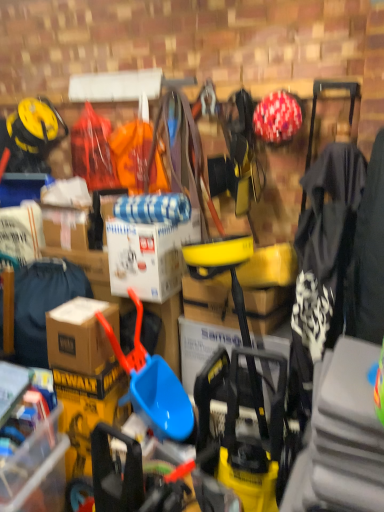
What is the approximate width of brown cardboard box at lower left?

brown cardboard box at lower left is 52.06 centimeters wide.

This screenshot has height=512, width=384. Identify the location of blue plastic shovel at center. (152, 385).

This screenshot has height=512, width=384. What do you see at coordinates (368, 256) in the screenshot?
I see `black fabric jacket at right, which ranks as the 1th clothing in front-to-back order` at bounding box center [368, 256].

Describe the element at coordinates (42, 304) in the screenshot. The height and width of the screenshot is (512, 384). I see `brown cardboard box at left, which is the first clothing from back to front` at that location.

The width and height of the screenshot is (384, 512). Find the location of `brown cardboard box at lower left`. brown cardboard box at lower left is located at coordinates (36, 470).

Considering the relative sizes of blue plastic shovel at center and white matte cardboard box at center in the image provided, is blue plastic shovel at center smaller than white matte cardboard box at center?

Incorrect, blue plastic shovel at center is not smaller in size than white matte cardboard box at center.

Could you tell me if blue plastic shovel at center is turned towards white matte cardboard box at center?

No, blue plastic shovel at center does not turn towards white matte cardboard box at center.

From the image's perspective, is blue plastic shovel at center over white matte cardboard box at center?

Incorrect, from the image's perspective, blue plastic shovel at center is lower than white matte cardboard box at center.

From a real-world perspective, who is located lower, blue plastic shovel at center or white matte cardboard box at center?

From a 3D spatial view, blue plastic shovel at center is below.

Which is less distant, (139, 369) or (88, 359)?

The point (88, 359) is closer to the camera.

Considering the sizes of objects blue plastic shovel at center and brown cardboard box at lower left in the image provided, who is wider, blue plastic shovel at center or brown cardboard box at lower left?

With larger width is brown cardboard box at lower left.

Which object is positioned more to the right, blue plastic shovel at center or brown cardboard box at lower left?

Positioned to the right is blue plastic shovel at center.

Does blue plastic shovel at center come behind brown cardboard box at lower left?

No, blue plastic shovel at center is closer to the viewer.

Is brown cardboard box at left, the 1th clothing from the left, to the right of black fabric jacket at right, the first clothing from the right, from the viewer's perspective?

In fact, brown cardboard box at left, the 1th clothing from the left, is to the left of black fabric jacket at right, the first clothing from the right.

Can you confirm if brown cardboard box at left, the 1th clothing from the left, is shorter than black fabric jacket at right, marked as the second clothing in a back-to-front arrangement?

Yes.

From a real-world perspective, which object rests below the other?

brown cardboard box at left, which is the first clothing from back to front.

Does point (64, 263) come closer to viewer compared to point (354, 254)?

No, (64, 263) is behind (354, 254).

Identify the location of storage box located on the left of black fabric jacket at right, placed as the second clothing when sorted from left to right. The height and width of the screenshot is (512, 384). (36, 470).

Can you tell me how much brown cardboard box at lower left and black fabric jacket at right, which ranks as the 1th clothing in front-to-back order, differ in facing direction?

7.02 degrees separate the facing orientations of brown cardboard box at lower left and black fabric jacket at right, which ranks as the 1th clothing in front-to-back order.

Does brown cardboard box at lower left contain black fabric jacket at right, placed as the second clothing when sorted from left to right?

No, black fabric jacket at right, placed as the second clothing when sorted from left to right, is not surrounded by brown cardboard box at lower left.

Relative to black fabric jacket at right, placed as the second clothing when sorted from left to right, is brown cardboard box at lower left in front or behind?

brown cardboard box at lower left is behind black fabric jacket at right, placed as the second clothing when sorted from left to right.

Is the depth of white matte cardboard box at center less than that of brown cardboard box at lower left?

No, white matte cardboard box at center is further to the viewer.

Is white matte cardboard box at center outside of brown cardboard box at lower left?

Indeed, white matte cardboard box at center is completely outside brown cardboard box at lower left.

How much distance is there between white matte cardboard box at center and brown cardboard box at lower left?

A distance of 29.22 inches exists between white matte cardboard box at center and brown cardboard box at lower left.

Considering the relative positions of white matte cardboard box at center and brown cardboard box at lower left in the image provided, is white matte cardboard box at center to the right of brown cardboard box at lower left from the viewer's perspective?

Correct, you'll find white matte cardboard box at center to the right of brown cardboard box at lower left.

Is white matte cardboard box at center positioned in front of brown cardboard box at lower left?

No, the depth of white matte cardboard box at center is greater than that of brown cardboard box at lower left.

Does white matte cardboard box at center have a smaller size compared to brown cardboard box at lower left?

Actually, white matte cardboard box at center might be larger than brown cardboard box at lower left.

From a real-world perspective, between white matte cardboard box at center and brown cardboard box at lower left, who is vertically higher?

white matte cardboard box at center is physically above.

Consider the image. Is brown cardboard box at lower left far away from brown cardboard box at lower left?

No, there isn't a large distance between brown cardboard box at lower left and brown cardboard box at lower left.

Is brown cardboard box at lower left positioned with its back to brown cardboard box at lower left?

No, brown cardboard box at lower left is not facing the opposite direction of brown cardboard box at lower left.

Which object is positioned more to the left, brown cardboard box at lower left or brown cardboard box at lower left?

From the viewer's perspective, brown cardboard box at lower left appears more on the left side.

Is brown cardboard box at lower left inside the boundaries of brown cardboard box at lower left, or outside?

brown cardboard box at lower left is not enclosed by brown cardboard box at lower left.

Where is `shovel below the white matte cardboard box at center (from the image's perspective)`? Image resolution: width=384 pixels, height=512 pixels. shovel below the white matte cardboard box at center (from the image's perspective) is located at coordinates (152, 385).

Where is `box behind the blue plastic shovel at center`? The image size is (384, 512). box behind the blue plastic shovel at center is located at coordinates (80, 335).

Estimate the real-world distances between objects in this image. Which object is further from brown cardboard box at left, which is the first clothing from back to front, brown cardboard box at lower left or brown cardboard box at lower left?

brown cardboard box at lower left.

From the image, which object appears to be nearer to brown cardboard box at lower left, white matte cardboard box at center or brown cardboard box at left, the 2th clothing in the right-to-left sequence?

The object closer to brown cardboard box at lower left is brown cardboard box at left, the 2th clothing in the right-to-left sequence.

Looking at the image, which one is located further to brown cardboard box at left, which is the first clothing from back to front, blue plastic shovel at center or black fabric jacket at right, marked as the second clothing in a back-to-front arrangement?

black fabric jacket at right, marked as the second clothing in a back-to-front arrangement, lies further to brown cardboard box at left, which is the first clothing from back to front, than the other object.

Which object lies further to the anchor point blue plastic shovel at center, brown cardboard box at left, which is the first clothing from back to front, or brown cardboard box at lower left?

Based on the image, brown cardboard box at left, which is the first clothing from back to front, appears to be further to blue plastic shovel at center.

Looking at the image, which one is located further to blue plastic shovel at center, white matte cardboard box at center or brown cardboard box at lower left?

Among the two, brown cardboard box at lower left is located further to blue plastic shovel at center.

From the image, which object appears to be farther from white matte cardboard box at center, brown cardboard box at lower left or black fabric jacket at right, marked as the second clothing in a back-to-front arrangement?

black fabric jacket at right, marked as the second clothing in a back-to-front arrangement, is further to white matte cardboard box at center.

Looking at the image, which one is located further to brown cardboard box at left, the 1th clothing from the left, blue plastic shovel at center or white matte cardboard box at center?

blue plastic shovel at center lies further to brown cardboard box at left, the 1th clothing from the left, than the other object.

Which object lies nearer to the anchor point blue plastic shovel at center, white matte cardboard box at center or black fabric jacket at right, the first clothing from the right?

Among the two, white matte cardboard box at center is located nearer to blue plastic shovel at center.

What are the coordinates of `box between brown cardboard box at left, which is counted as the 2th clothing, starting from the front, and brown cardboard box at lower left in the up-down direction` in the screenshot? It's located at (80, 335).

Find the location of `box between brown cardboard box at left, the 2th clothing in the right-to-left sequence, and black fabric jacket at right, the first clothing from the right`. box between brown cardboard box at left, the 2th clothing in the right-to-left sequence, and black fabric jacket at right, the first clothing from the right is located at coordinates click(x=80, y=335).

You are a GUI agent. You are given a task and a screenshot of the screen. Output one action in this format:
    pyautogui.click(x=<x>, y=<y>)
    Task: Click on the box between brown cardboard box at lower left and black fabric jacket at right, marked as the second clothing in a back-to-front arrangement, from left to right
    This screenshot has height=512, width=384.
    Given the screenshot: What is the action you would take?
    pyautogui.click(x=80, y=335)

Find the location of a particular element. shovel between brown cardboard box at left, the 2th clothing in the right-to-left sequence, and white matte cardboard box at center is located at coordinates (152, 385).